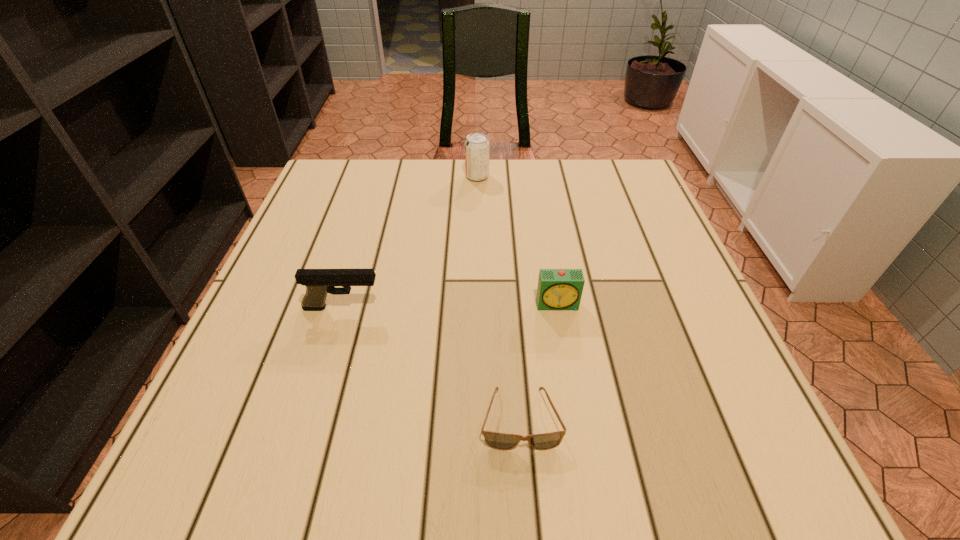
The width and height of the screenshot is (960, 540). I want to click on soda can, so click(x=477, y=146).

This screenshot has width=960, height=540. What are the coordinates of `the leftmost object` in the screenshot? It's located at (319, 282).

Image resolution: width=960 pixels, height=540 pixels. Find the location of `alarm clock`. alarm clock is located at coordinates (558, 289).

The width and height of the screenshot is (960, 540). In order to click on the nearest object in this screenshot , I will do `click(501, 441)`.

This screenshot has height=540, width=960. Identify the location of sunglasses. (501, 441).

Where is `vacant space located on the left of the soda can`? This screenshot has height=540, width=960. vacant space located on the left of the soda can is located at coordinates (367, 176).

Locate an element on the screen. The image size is (960, 540). vacant space situated on the front-facing side of the pistol is located at coordinates (572, 308).

At what (x,y) coordinates should I click in order to perform the action: click on vacant position located on the front-facing side of the alarm clock. Please return your answer as a coordinate pair (x, y). Looking at the image, I should click on (x=581, y=440).

Locate an element on the screen. This screenshot has width=960, height=540. object located in the far edge section of the desktop is located at coordinates (477, 146).

This screenshot has height=540, width=960. I want to click on object that is at the near edge, so click(501, 441).